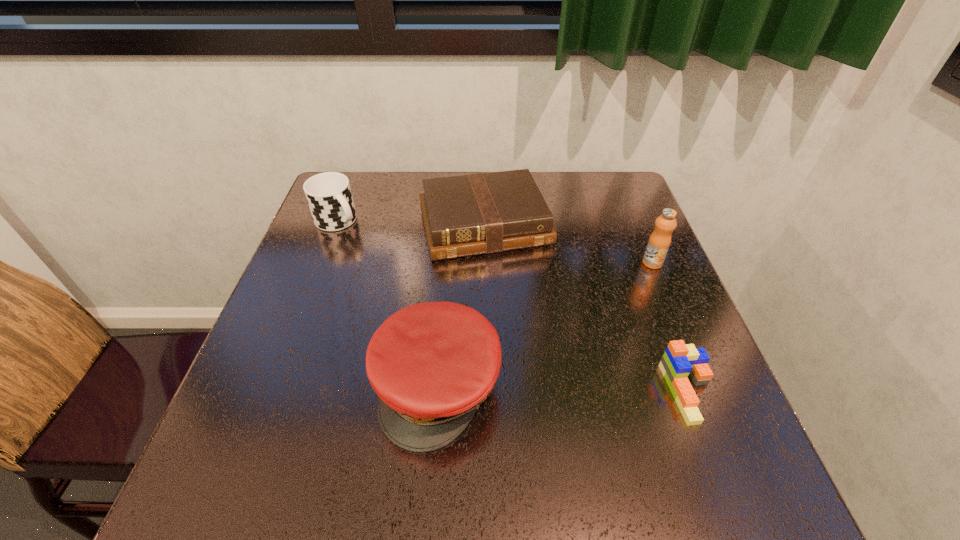
Where is `vacant space situated on the spine side of the Bible`? The height and width of the screenshot is (540, 960). vacant space situated on the spine side of the Bible is located at coordinates (528, 339).

Where is `free space located 0.210m on the spine side of the Bible`? free space located 0.210m on the spine side of the Bible is located at coordinates (524, 328).

I want to click on vacant space located 0.080m on the side of the leftmost object with the handle, so click(366, 246).

This screenshot has width=960, height=540. I want to click on free region located on the side of the leftmost object with the handle, so click(x=366, y=246).

The height and width of the screenshot is (540, 960). Find the location of `vacant area situated 0.230m on the side of the leftmost object with the handle`. vacant area situated 0.230m on the side of the leftmost object with the handle is located at coordinates (400, 276).

Find the location of `Bible that is at the far edge`. Bible that is at the far edge is located at coordinates (472, 214).

This screenshot has width=960, height=540. Identify the location of cup that is positioned at the far edge. (329, 196).

The height and width of the screenshot is (540, 960). Identify the location of cap present at the near edge. (431, 364).

I want to click on Lego situated at the near edge, so click(x=679, y=360).

Image resolution: width=960 pixels, height=540 pixels. Find the location of `object at the left edge`. object at the left edge is located at coordinates (329, 196).